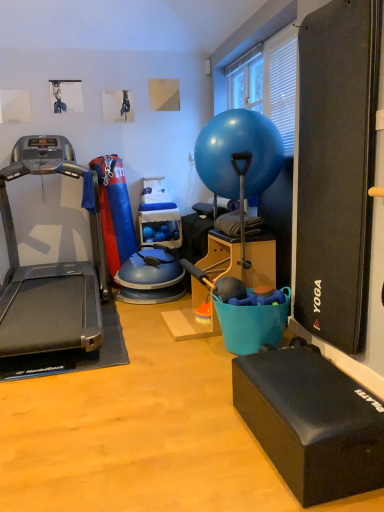
Question: Is black rubber yoga block at lower right, the first box when ordered from bottom to top, further to the viewer compared to teal plastic bucket at center, which is the 2th box in front-to-back order?

Choices:
 (A) yes
 (B) no

Answer: (B)

Question: Are black rubber yoga block at lower right, the first box positioned from the front, and teal plastic bucket at center, positioned as the first box in top-to-bottom order, beside each other?

Choices:
 (A) no
 (B) yes

Answer: (A)

Question: Is the position of black rubber yoga block at lower right, the 2th box in the back-to-front sequence, less distant than that of teal plastic bucket at center, which ranks as the first box in back-to-front order?

Choices:
 (A) yes
 (B) no

Answer: (A)

Question: Can you confirm if black rubber yoga block at lower right, the 2th box positioned from the top, is shorter than teal plastic bucket at center, marked as the 2th box in a bottom-to-top arrangement?

Choices:
 (A) no
 (B) yes

Answer: (B)

Question: Is black rubber yoga block at lower right, the 2th box positioned from the top, positioned far away from teal plastic bucket at center, positioned as the first box in top-to-bottom order?

Choices:
 (A) no
 (B) yes

Answer: (B)

Question: From the image's perspective, does black rubber yoga block at lower right, the 2th box in the back-to-front sequence, appear lower than teal plastic bucket at center, positioned as the first box in top-to-bottom order?

Choices:
 (A) yes
 (B) no

Answer: (A)

Question: Is teal plastic bucket at center, which is the 2th box in front-to-back order, wider than black rubber yoga block at lower right, the 2th box in the back-to-front sequence?

Choices:
 (A) yes
 (B) no

Answer: (A)

Question: Is teal plastic bucket at center, which is the 2th box in front-to-back order, shorter than black rubber yoga block at lower right, the first box positioned from the front?

Choices:
 (A) no
 (B) yes

Answer: (A)

Question: Are teal plastic bucket at center, marked as the 2th box in a bottom-to-top arrangement, and black rubber yoga block at lower right, the 2th box positioned from the top, far apart?

Choices:
 (A) yes
 (B) no

Answer: (A)

Question: Is teal plastic bucket at center, which ranks as the first box in back-to-front order, positioned with its back to black rubber yoga block at lower right, the first box when ordered from bottom to top?

Choices:
 (A) no
 (B) yes

Answer: (A)

Question: Is the position of teal plastic bucket at center, which is the 2th box in front-to-back order, more distant than that of black rubber yoga block at lower right, the first box when ordered from bottom to top?

Choices:
 (A) no
 (B) yes

Answer: (B)

Question: Can you confirm if teal plastic bucket at center, which is the 2th box in front-to-back order, is thinner than black rubber yoga block at lower right, the first box positioned from the front?

Choices:
 (A) no
 (B) yes

Answer: (A)

Question: Can you confirm if metallic gray treadmill at left is taller than black rubber yoga block at lower right, the first box when ordered from bottom to top?

Choices:
 (A) no
 (B) yes

Answer: (B)